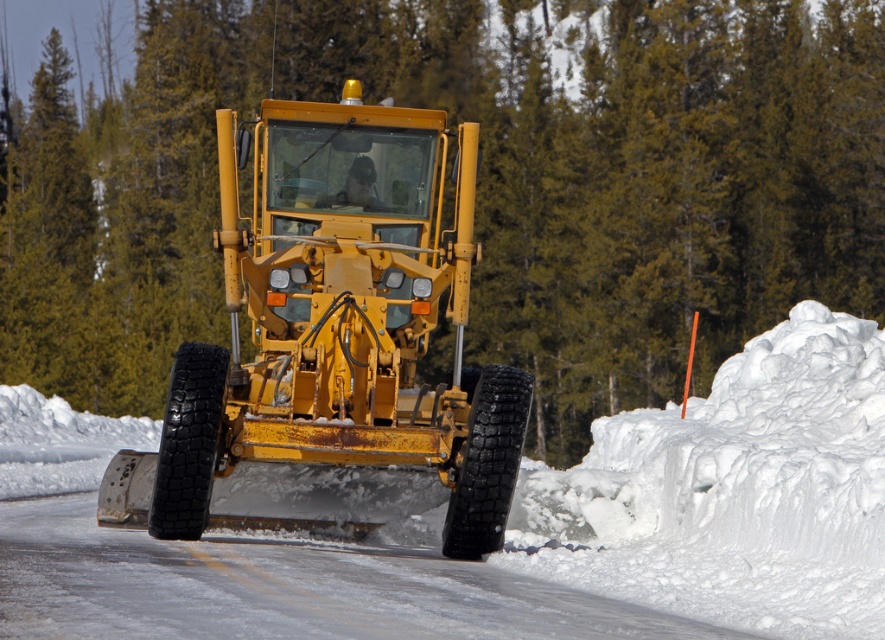
You are a snowplow operator trying to clear the road. There is a white fluffy snow at center at point (509, 525). Where should you direct your snowplow blade to effectively remove this snow?

You should direct your snowplow blade towards the white fluffy snow at center located at point (509, 525) to effectively remove it.

You are a driver approaching the green textured tree at upper center and the yellow metallic snowplow at center. Which object is closer to your current position?

The green textured tree at upper center is closer to your current position because the yellow metallic snowplow at center is behind it.